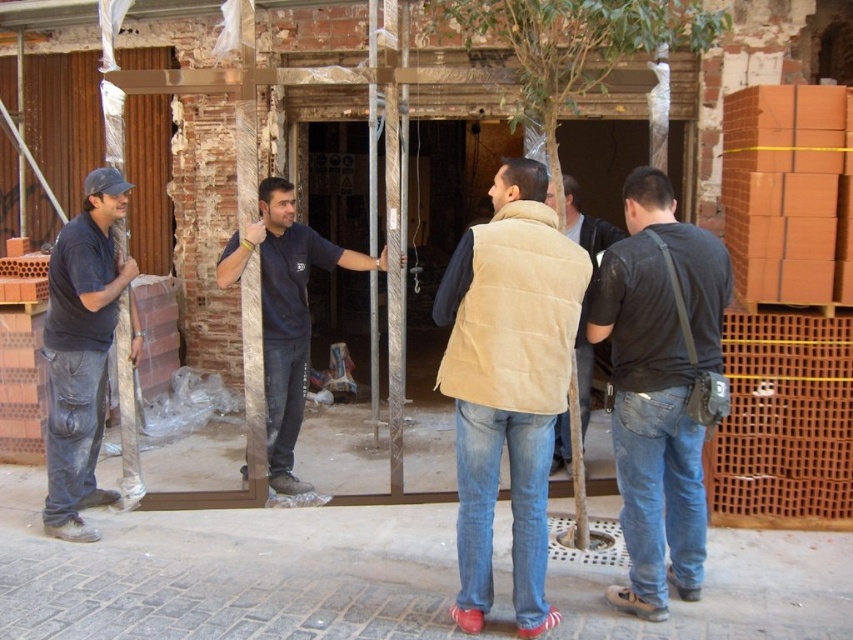
Question: Where is beige suede vest at center located in relation to black denim jeans at right in the image?

Choices:
 (A) left
 (B) right

Answer: (A)

Question: Does black denim jeans at right have a larger size compared to matte black shirt at left?

Choices:
 (A) no
 (B) yes

Answer: (A)

Question: Among these points, which one is nearest to the camera?

Choices:
 (A) (560, 420)
 (B) (463, 598)
 (C) (653, 305)
 (D) (65, 477)

Answer: (C)

Question: Which point is farther from the camera taking this photo?

Choices:
 (A) (660, 440)
 (B) (509, 170)

Answer: (A)

Question: Does black denim jeans at right appear on the right side of matte black shirt at left?

Choices:
 (A) yes
 (B) no

Answer: (A)

Question: Which point is farther to the camera?

Choices:
 (A) (297, 241)
 (B) (479, 312)

Answer: (A)